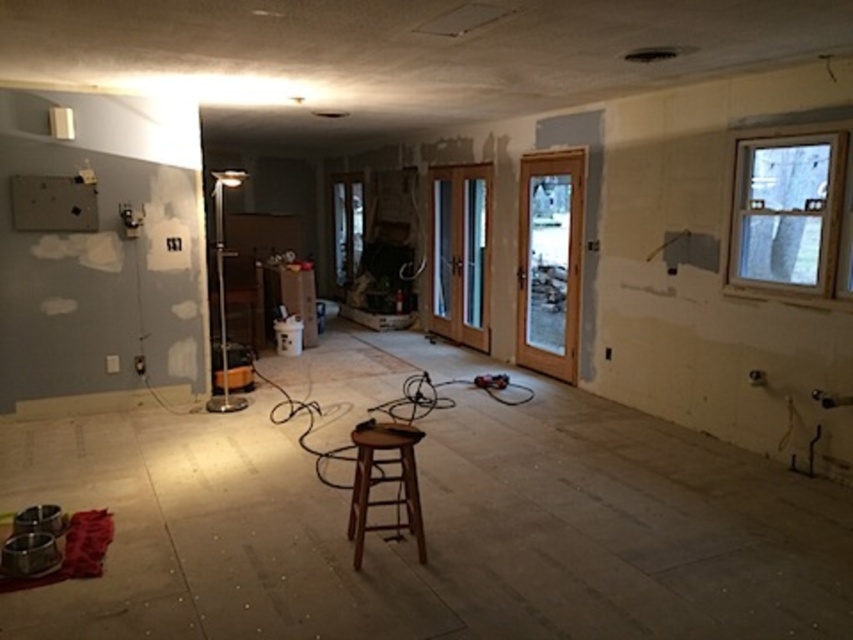
Question: Which of the following is the closest to the observer?

Choices:
 (A) (767, 182)
 (B) (422, 531)

Answer: (B)

Question: Can you confirm if clear glass window at upper right is thinner than brown wooden stool at center?

Choices:
 (A) no
 (B) yes

Answer: (B)

Question: Is clear glass window at upper right smaller than brown wooden stool at center?

Choices:
 (A) no
 (B) yes

Answer: (B)

Question: Can you confirm if clear glass window at upper right is bigger than brown wooden stool at center?

Choices:
 (A) no
 (B) yes

Answer: (A)

Question: Which point appears closest to the camera in this image?

Choices:
 (A) (375, 429)
 (B) (750, 145)

Answer: (A)